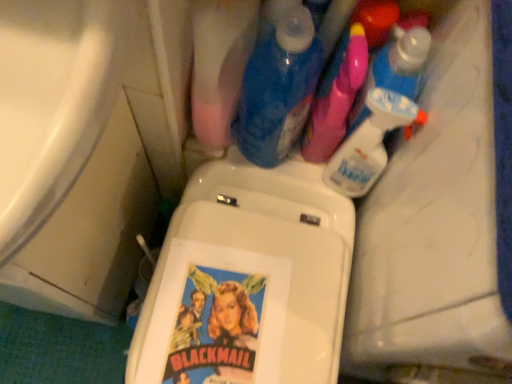
Question: Considering the relative sizes of white glossy bathtub at lower left and clear plastic spray bottle at upper right, which appears as the 2th cleaning product when viewed from the right, in the image provided, is white glossy bathtub at lower left smaller than clear plastic spray bottle at upper right, which appears as the 2th cleaning product when viewed from the right,?

Choices:
 (A) yes
 (B) no

Answer: (B)

Question: Would you consider white glossy bathtub at lower left to be distant from clear plastic spray bottle at upper right, the 3th cleaning product in the left-to-right sequence?

Choices:
 (A) yes
 (B) no

Answer: (B)

Question: From a real-world perspective, is white glossy bathtub at lower left over clear plastic spray bottle at upper right, which appears as the 2th cleaning product when viewed from the right?

Choices:
 (A) no
 (B) yes

Answer: (A)

Question: Does white glossy bathtub at lower left touch clear plastic spray bottle at upper right, the 3th cleaning product in the left-to-right sequence?

Choices:
 (A) yes
 (B) no

Answer: (B)

Question: From the image's perspective, would you say white glossy bathtub at lower left is positioned over clear plastic spray bottle at upper right, which appears as the 2th cleaning product when viewed from the right?

Choices:
 (A) yes
 (B) no

Answer: (B)

Question: Can you confirm if white glossy bathtub at lower left is thinner than clear plastic spray bottle at upper right, the 3th cleaning product in the left-to-right sequence?

Choices:
 (A) yes
 (B) no

Answer: (B)

Question: Is translucent plastic spray bottle at upper right, which ranks as the fourth cleaning product in left-to-right order, wider than white glossy bathtub at lower left?

Choices:
 (A) no
 (B) yes

Answer: (A)

Question: From the image's perspective, is translucent plastic spray bottle at upper right, positioned as the 1th cleaning product in right-to-left order, under white glossy bathtub at lower left?

Choices:
 (A) yes
 (B) no

Answer: (B)

Question: Does translucent plastic spray bottle at upper right, which ranks as the fourth cleaning product in left-to-right order, appear on the left side of white glossy bathtub at lower left?

Choices:
 (A) yes
 (B) no

Answer: (B)

Question: Is translucent plastic spray bottle at upper right, positioned as the 1th cleaning product in right-to-left order, closer to the viewer compared to white glossy bathtub at lower left?

Choices:
 (A) yes
 (B) no

Answer: (B)

Question: Is the position of translucent plastic spray bottle at upper right, positioned as the 1th cleaning product in right-to-left order, more distant than that of white glossy bathtub at lower left?

Choices:
 (A) no
 (B) yes

Answer: (B)

Question: From a real-world perspective, is translucent plastic spray bottle at upper right, which ranks as the fourth cleaning product in left-to-right order, beneath white glossy bathtub at lower left?

Choices:
 (A) yes
 (B) no

Answer: (B)

Question: Is translucent plastic spray bottle at upper right, which ranks as the fourth cleaning product in left-to-right order, positioned behind pink plastic spray bottle at upper right, which is the 2th cleaning product in left-to-right order?

Choices:
 (A) no
 (B) yes

Answer: (B)